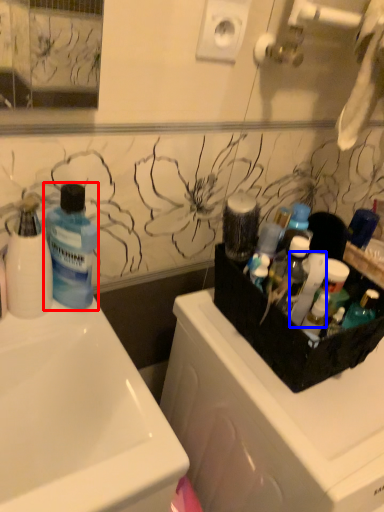
Question: Which of the following is the closest to the observer, bottle (highlighted by a red box) or cleaning product (highlighted by a blue box)?

Choices:
 (A) bottle
 (B) cleaning product

Answer: (A)